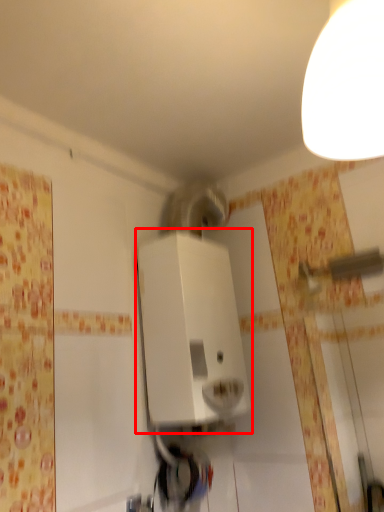
Question: From the image's perspective, what is the correct spatial positioning of appliance (annotated by the red box) in reference to light fixture?

Choices:
 (A) above
 (B) below

Answer: (B)